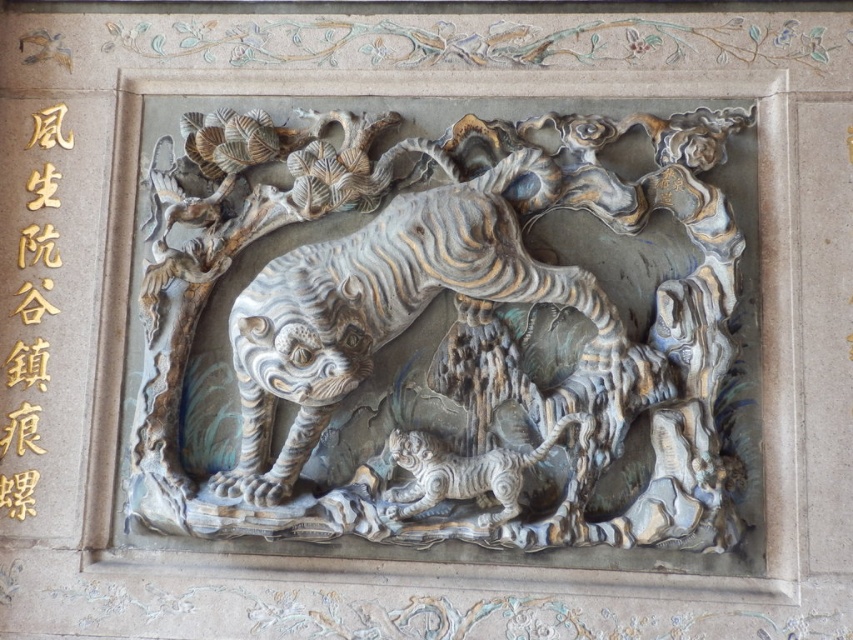
Which is behind, point (26, 120) or point (488, 476)?

The point (26, 120) is more distant.

Is point (10, 182) farther from viewer compared to point (410, 440)?

Yes, point (10, 182) is farther from viewer.

At what (x,y) coordinates should I click in order to perform the action: click on goldmaterial/texturechinese characters at left. Please return your answer as a coordinate pair (x, y). Looking at the image, I should click on (38, 310).

Between gray stone tiger at center and goldmaterial/texturechinese characters at left, which one is positioned higher?

gray stone tiger at center

Consider the image. Is gray stone tiger at center to the left of goldmaterial/texturechinese characters at left from the viewer's perspective?

In fact, gray stone tiger at center is to the right of goldmaterial/texturechinese characters at left.

Find the location of a particular element. The width and height of the screenshot is (853, 640). gray stone tiger at center is located at coordinates (439, 332).

Between gray stone tiger at center and white marble tiger at center, which one is positioned lower?

white marble tiger at center is lower down.

Does point (170, 179) lie behind point (587, 440)?

Yes, it is.

Measure the distance between point (347, 275) and camera.

They are 1.62 meters apart.

Find the location of a particular element. The image size is (853, 640). gray stone tiger at center is located at coordinates (439, 332).